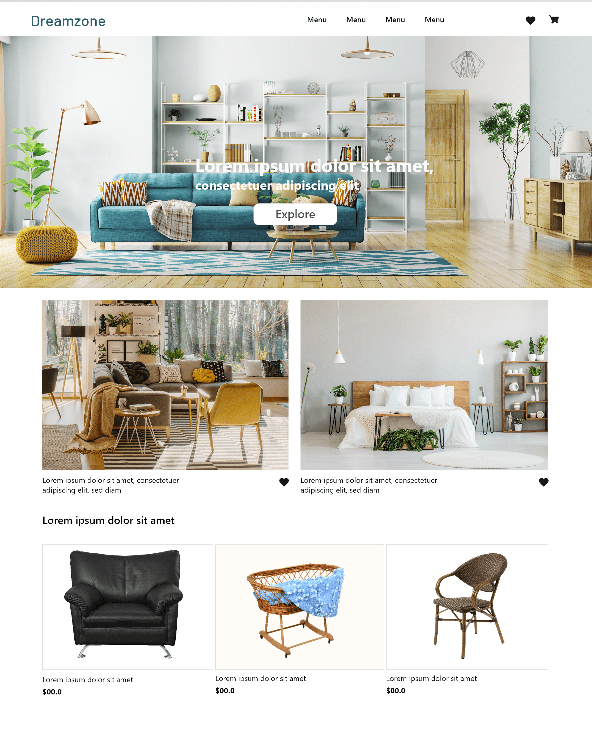
Identify the location of chair. This screenshot has width=592, height=750. (228, 406), (480, 567).